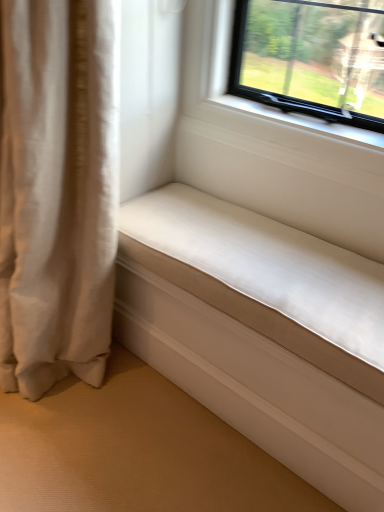
Question: Can you confirm if beige fabric curtain at left is thinner than white smooth cushion at lower right?

Choices:
 (A) no
 (B) yes

Answer: (A)

Question: Does beige fabric curtain at left come behind white smooth cushion at lower right?

Choices:
 (A) no
 (B) yes

Answer: (A)

Question: Considering the relative sizes of beige fabric curtain at left and white smooth cushion at lower right in the image provided, is beige fabric curtain at left smaller than white smooth cushion at lower right?

Choices:
 (A) yes
 (B) no

Answer: (B)

Question: Is beige fabric curtain at left touching white smooth cushion at lower right?

Choices:
 (A) no
 (B) yes

Answer: (A)

Question: Does beige fabric curtain at left have a greater width compared to white smooth cushion at lower right?

Choices:
 (A) yes
 (B) no

Answer: (A)

Question: Is beige fabric curtain at left oriented towards white smooth cushion at lower right?

Choices:
 (A) no
 (B) yes

Answer: (A)

Question: Considering the relative sizes of white smooth cushion at lower right and beige fabric curtain at left in the image provided, is white smooth cushion at lower right smaller than beige fabric curtain at left?

Choices:
 (A) yes
 (B) no

Answer: (A)

Question: Does white smooth cushion at lower right have a greater width compared to beige fabric curtain at left?

Choices:
 (A) no
 (B) yes

Answer: (A)

Question: Does white smooth cushion at lower right have a larger size compared to beige fabric curtain at left?

Choices:
 (A) yes
 (B) no

Answer: (B)

Question: Can you confirm if white smooth cushion at lower right is positioned to the right of beige fabric curtain at left?

Choices:
 (A) no
 (B) yes

Answer: (B)

Question: From the image's perspective, would you say white smooth cushion at lower right is shown under beige fabric curtain at left?

Choices:
 (A) yes
 (B) no

Answer: (A)

Question: Is there a large distance between white smooth cushion at lower right and beige fabric curtain at left?

Choices:
 (A) yes
 (B) no

Answer: (B)

Question: In terms of height, does beige fabric curtain at left look taller or shorter compared to white smooth cushion at lower right?

Choices:
 (A) tall
 (B) short

Answer: (A)